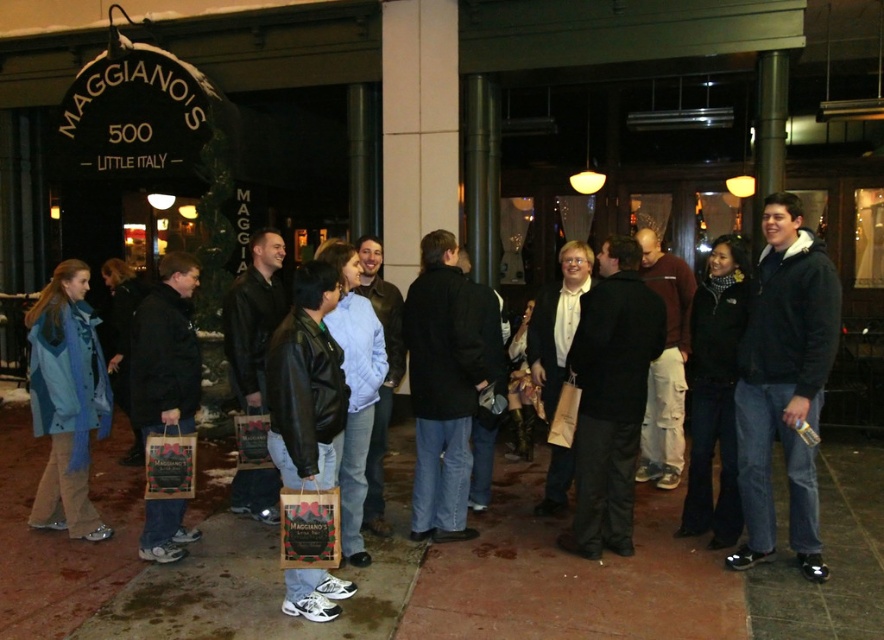
You are a photographer trying to capture both the matte black jacket at center and the leather jacket at center in a single shot. Based on their widths, which jacket might require you to adjust your camera angle to ensure it fits in the frame?

The matte black jacket at center might be wider than the leather jacket at center, so it could require adjusting the camera angle to fit in the frame.

You are a fashion blogger trying to decide which jacket to feature in your next post. You see both the matte black jacket at center and the leather jacket at center. Which one appears bigger in size?

The matte black jacket at center has a larger size compared to the leather jacket at center, so it appears bigger in size.